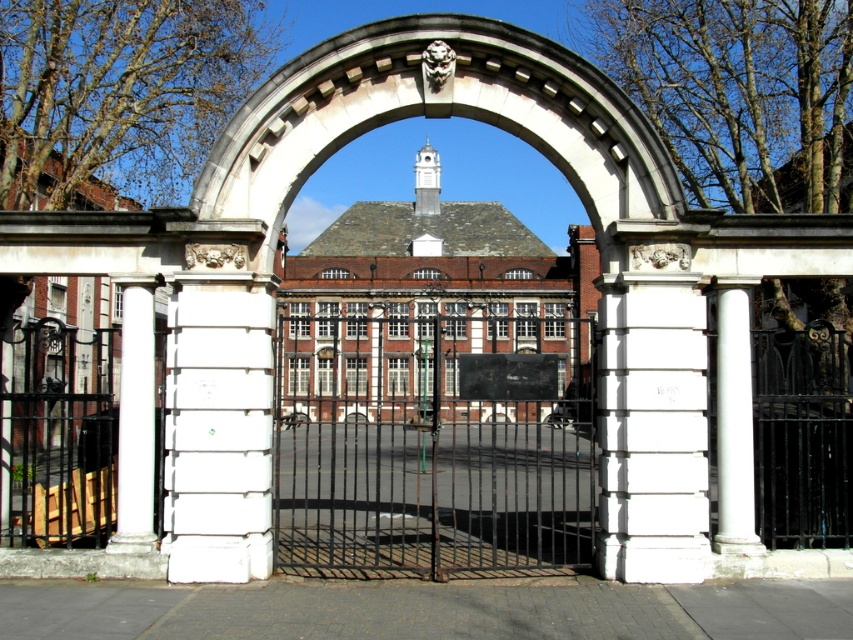
Who is lower down, white smooth pillar at center or white marble column at left?

white smooth pillar at center is below.

Which of these two, white smooth pillar at center or white marble column at left, stands shorter?

white marble column at left

Does point (199, 285) come farther from viewer compared to point (120, 426)?

No, it is in front of (120, 426).

You are a GUI agent. You are given a task and a screenshot of the screen. Output one action in this format:
    pyautogui.click(x=<x>, y=<y>)
    Task: Click on the white smooth pillar at center
    The height and width of the screenshot is (640, 853).
    Given the screenshot: What is the action you would take?
    pyautogui.click(x=219, y=429)

Is white smooth pillar at center taller than white marble column at right?

Yes, white smooth pillar at center is taller than white marble column at right.

Consider the image. How far apart are white smooth pillar at center and white marble column at right?

They are 5.35 meters apart.

Between point (260, 576) and point (724, 285), which one is positioned behind?

The point (724, 285) is behind.

You are a GUI agent. You are given a task and a screenshot of the screen. Output one action in this format:
    pyautogui.click(x=<x>, y=<y>)
    Task: Click on the white smooth pillar at center
    The width and height of the screenshot is (853, 640).
    Given the screenshot: What is the action you would take?
    pyautogui.click(x=219, y=429)

Is white stone archway at center above white smooth pillar at center?

Incorrect, white stone archway at center is not positioned above white smooth pillar at center.

Consider the image. Is white stone archway at center below white smooth pillar at center?

Yes.

Does point (236, 316) come closer to viewer compared to point (196, 435)?

That is False.

What are the coordinates of `white stone archway at center` in the screenshot? It's located at (601, 282).